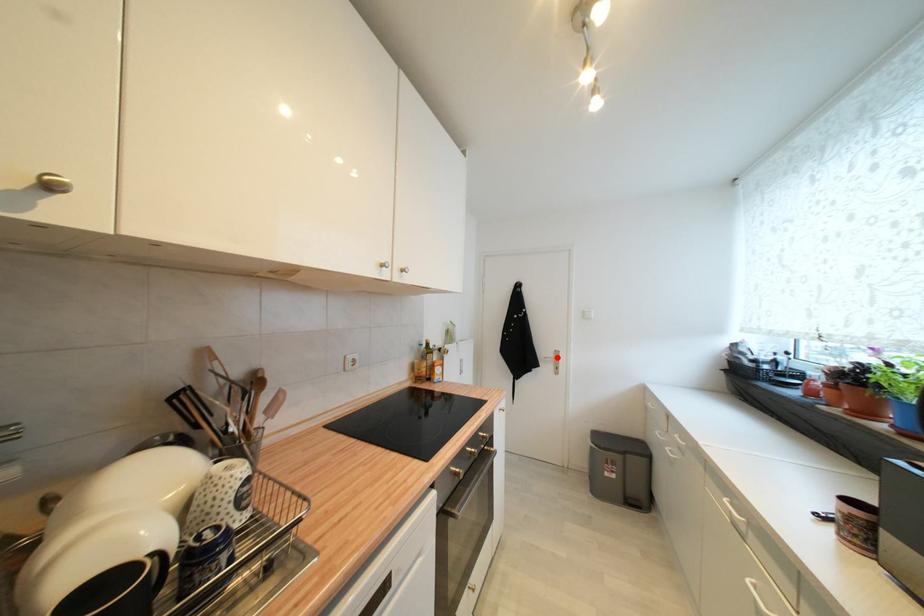
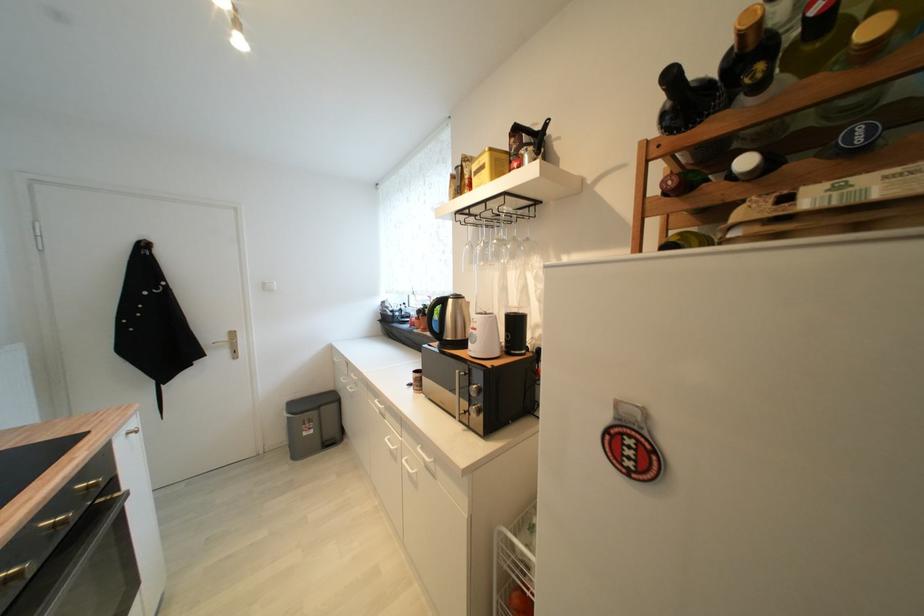
In the second image, find the point that corresponds to the highlighted location in the first image.

(229, 339)